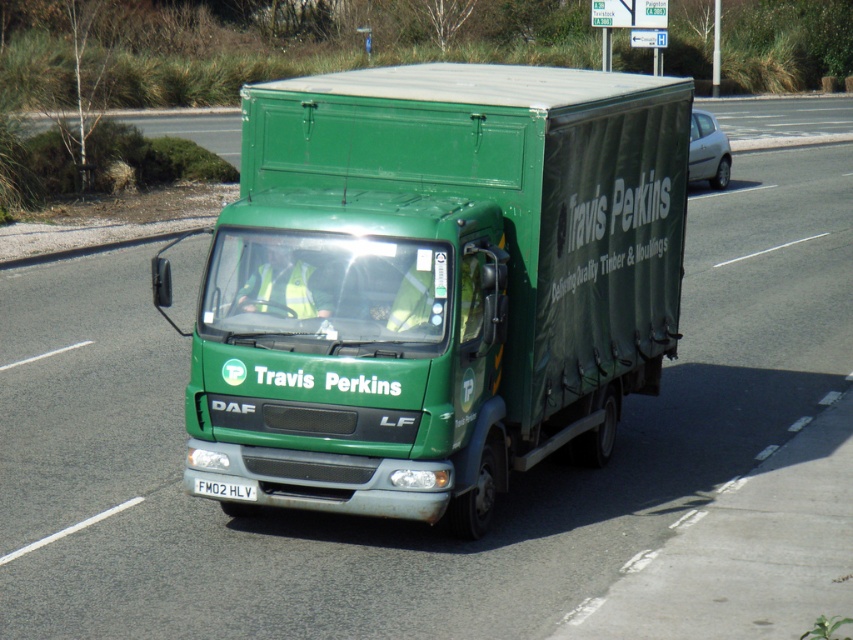
Can you confirm if green matte truck at center is positioned to the right of white plastic license plate at center?

Indeed, green matte truck at center is positioned on the right side of white plastic license plate at center.

Does green matte truck at center appear over white plastic license plate at center?

Yes, green matte truck at center is above white plastic license plate at center.

Is point (373, 145) behind point (194, 492)?

Yes, it is.

At what (x,y) coordinates should I click in order to perform the action: click on green matte truck at center. Please return your answer as a coordinate pair (x, y). Looking at the image, I should click on (434, 284).